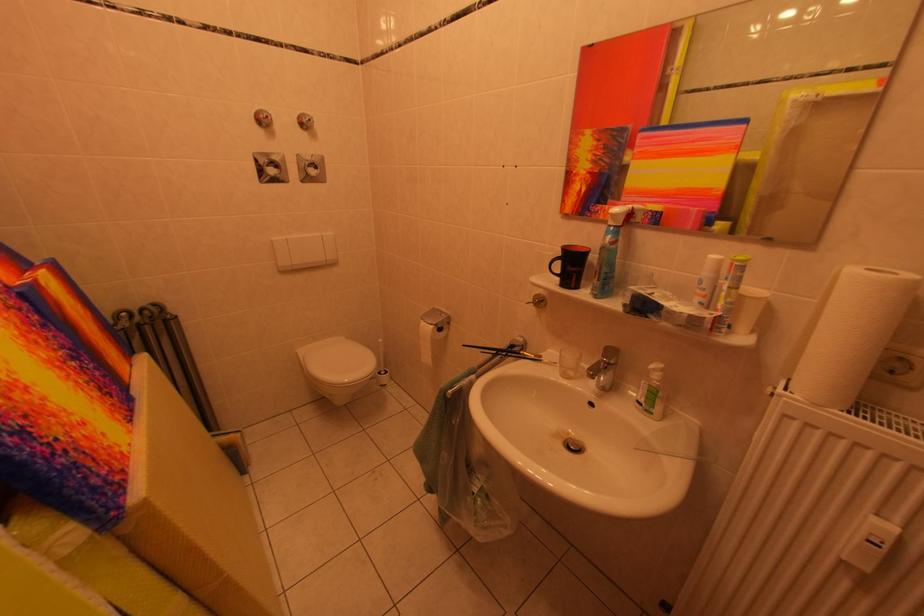
I want to click on paper towel roll, so click(850, 334).